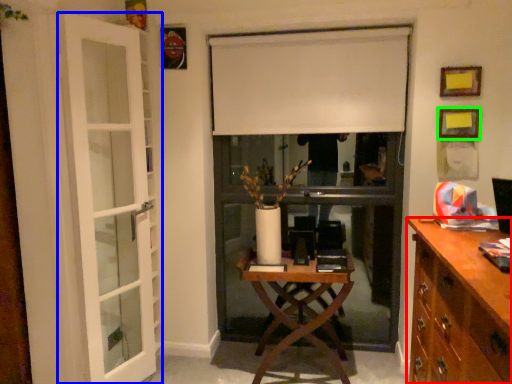
Question: Estimate the real-world distances between objects in this image. Which object is farther from cabinetry (highlighted by a red box), door (highlighted by a blue box) or picture frame (highlighted by a green box)?

Choices:
 (A) door
 (B) picture frame

Answer: (A)